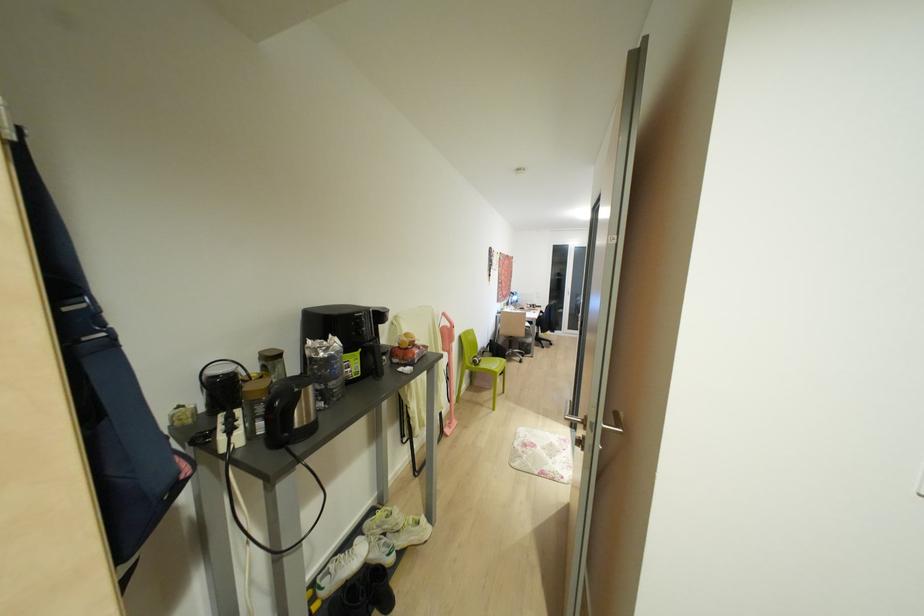
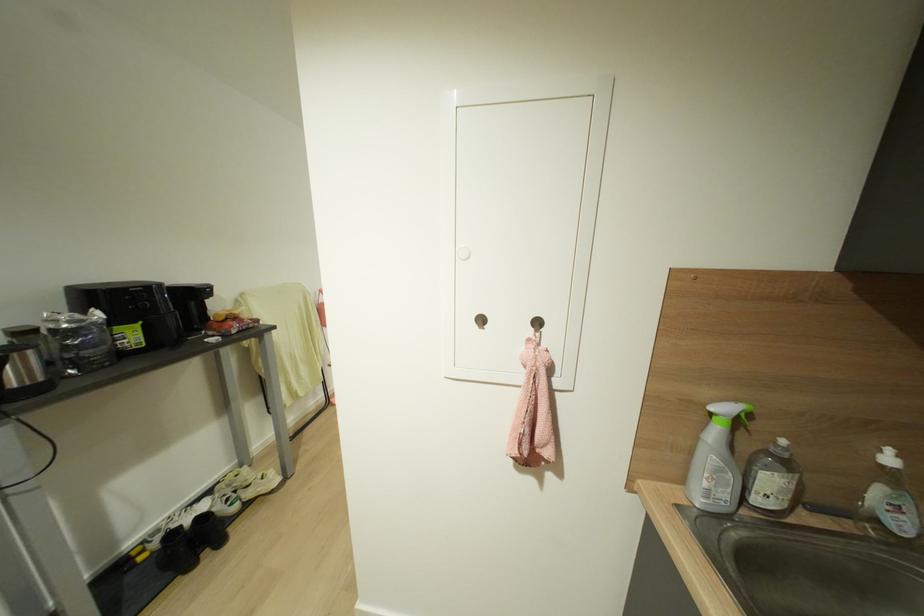
The point at (378, 525) is marked in the first image. Where is the corresponding point in the second image?

(227, 485)